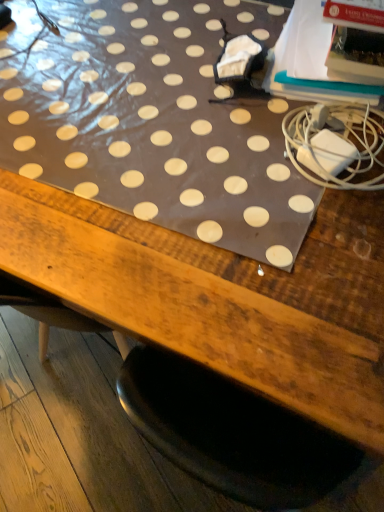
At what (x,y) coordinates should I click in order to perform the action: click on vacant space that is to the left of white matte cable at upper right. Please return your answer as a coordinate pair (x, y). Image resolution: width=384 pixels, height=512 pixels. Looking at the image, I should click on (220, 155).